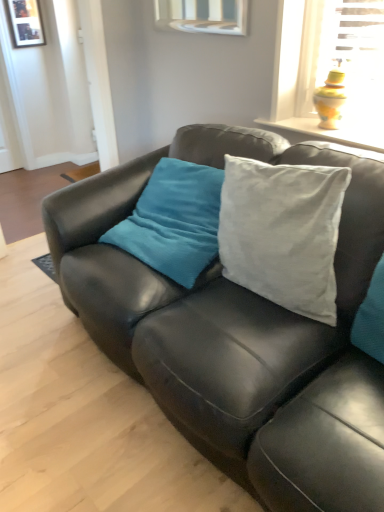
Question: From the image's perspective, is matte black couch at center located above or below wooden picture frame at upper left?

Choices:
 (A) below
 (B) above

Answer: (A)

Question: Considering their positions, is matte black couch at center located in front of or behind wooden picture frame at upper left?

Choices:
 (A) front
 (B) behind

Answer: (A)

Question: Considering the positions of matte black couch at center and wooden picture frame at upper left in the image, is matte black couch at center taller or shorter than wooden picture frame at upper left?

Choices:
 (A) tall
 (B) short

Answer: (A)

Question: In terms of height, does wooden picture frame at upper left look taller or shorter compared to matte black couch at center?

Choices:
 (A) tall
 (B) short

Answer: (B)

Question: Relative to matte black couch at center, is wooden picture frame at upper left in front or behind?

Choices:
 (A) behind
 (B) front

Answer: (A)

Question: Considering the positions of wooden picture frame at upper left and matte black couch at center in the image, is wooden picture frame at upper left wider or thinner than matte black couch at center?

Choices:
 (A) wide
 (B) thin

Answer: (B)

Question: From a real-world perspective, is wooden picture frame at upper left above or below matte black couch at center?

Choices:
 (A) above
 (B) below

Answer: (A)